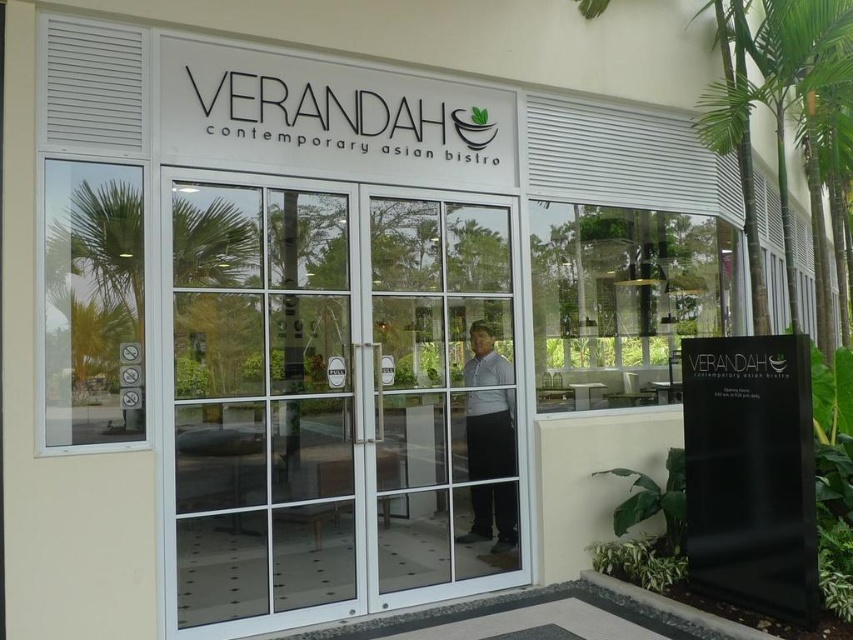
Question: Where is transparent glass door at center located in relation to white shirt at center in the image?

Choices:
 (A) above
 (B) below

Answer: (A)

Question: Which point is farther to the camera?

Choices:
 (A) white shirt at center
 (B) transparent glass door at center

Answer: (A)

Question: Is white glass door at center to the left of white shirt at center from the viewer's perspective?

Choices:
 (A) yes
 (B) no

Answer: (A)

Question: From the image, what is the correct spatial relationship of transparent glass door at center in relation to white shirt at center?

Choices:
 (A) left
 (B) right

Answer: (A)

Question: Which of these objects is positioned closest to the white shirt at center?

Choices:
 (A) transparent glass door at center
 (B) white glass door at center

Answer: (B)

Question: Which object appears closest to the camera in this image?

Choices:
 (A) white glass door at center
 (B) transparent glass door at center

Answer: (B)